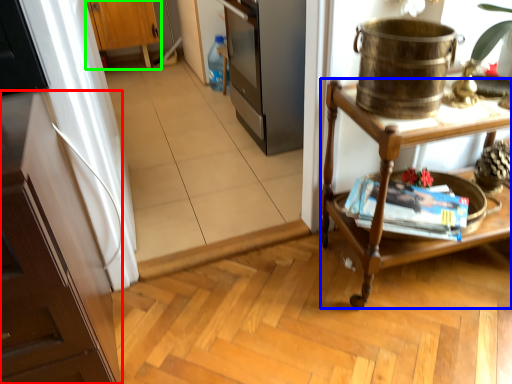
Question: Based on their relative distances, which object is nearer to cabinetry (highlighted by a red box)? Choose from desk (highlighted by a blue box) and cabinetry (highlighted by a green box).

Choices:
 (A) desk
 (B) cabinetry

Answer: (A)